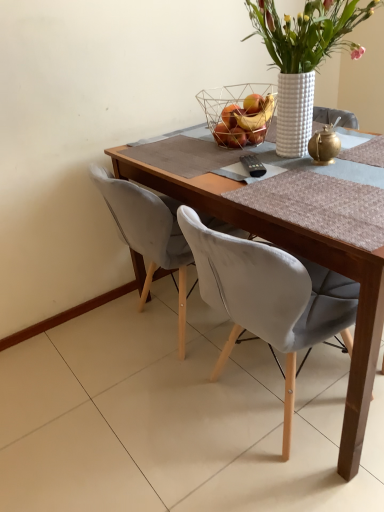
The width and height of the screenshot is (384, 512). What are the coordinates of `free space to the right of gold metallic teapot at upper right` in the screenshot? It's located at (361, 156).